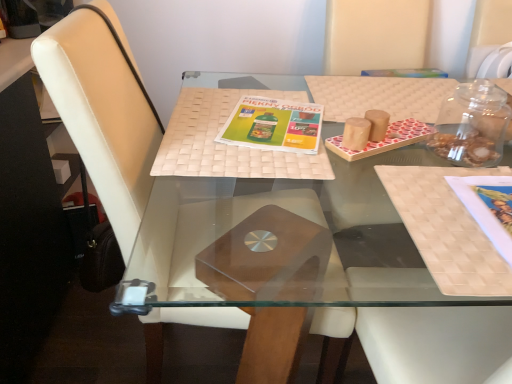
The image size is (512, 384). What are the coordinates of `spots to the right of green matte magazine at center, which is the first book cover from top to bottom` in the screenshot? It's located at (364, 114).